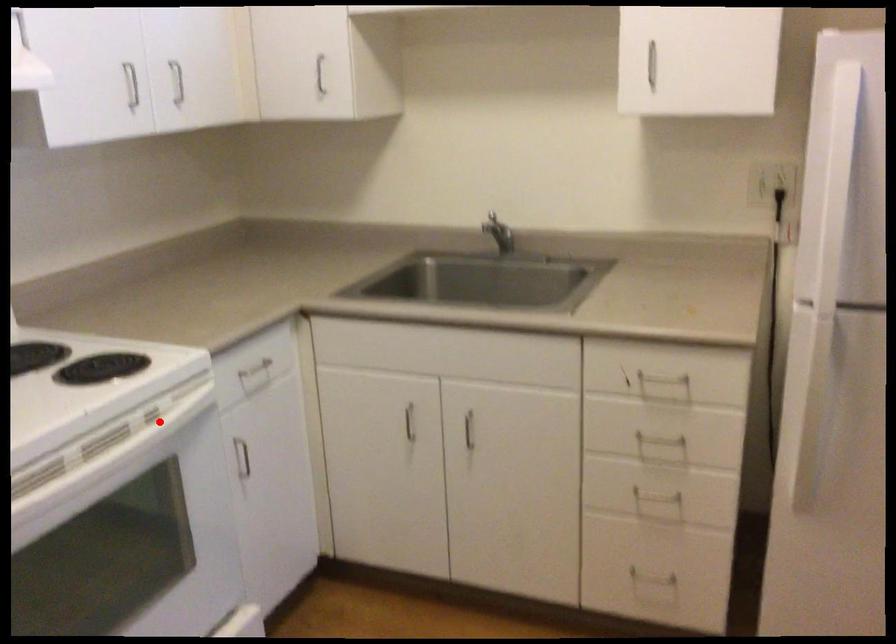
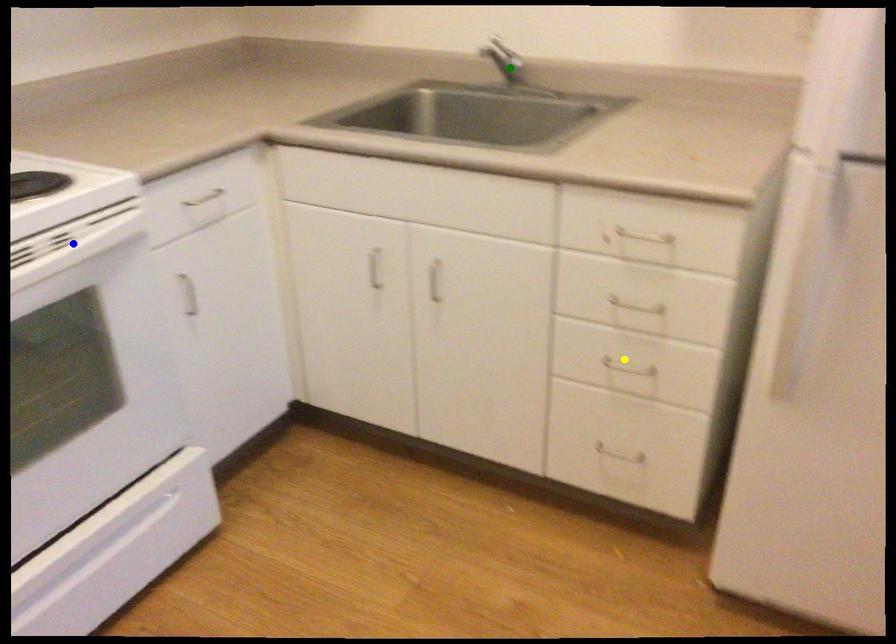
Question: I am providing you with two images of the same scene from different viewpoints. A red point is marked on the first image. You are given multiple points on the second image. Which spot in image 2 lines up with the point in image 1?

Choices:
 (A) blue point
 (B) green point
 (C) yellow point

Answer: (A)